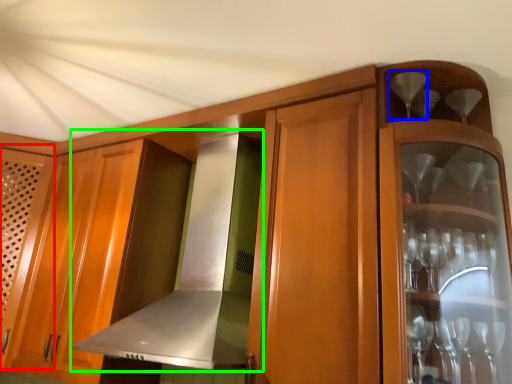
Question: Which object is the closest to the door (highlighted by a red box)? Choose among these: wine glass (highlighted by a blue box) or exhaust hood (highlighted by a green box).

Choices:
 (A) wine glass
 (B) exhaust hood

Answer: (B)